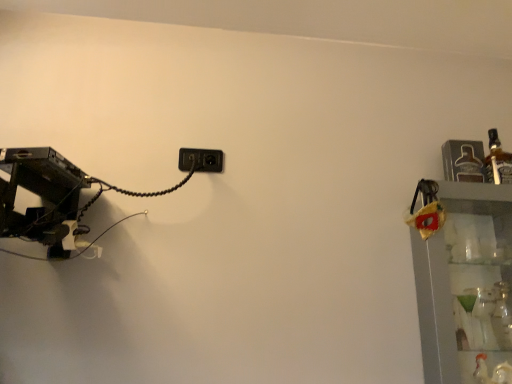
Question: Considering the positions of clear glass shelves at right and black plastic power plugs and sockets at center in the image, is clear glass shelves at right taller or shorter than black plastic power plugs and sockets at center?

Choices:
 (A) tall
 (B) short

Answer: (A)

Question: Based on their positions, is clear glass shelves at right located to the left or right of black plastic power plugs and sockets at center?

Choices:
 (A) left
 (B) right

Answer: (B)

Question: Based on their relative distances, which object is nearer to the translucent glass bottle at upper right?

Choices:
 (A) black plastic power plugs and sockets at center
 (B) clear glass shelves at right

Answer: (B)

Question: Which object is positioned closest to the clear glass shelves at right?

Choices:
 (A) black plastic power plugs and sockets at center
 (B) translucent glass bottle at upper right

Answer: (B)